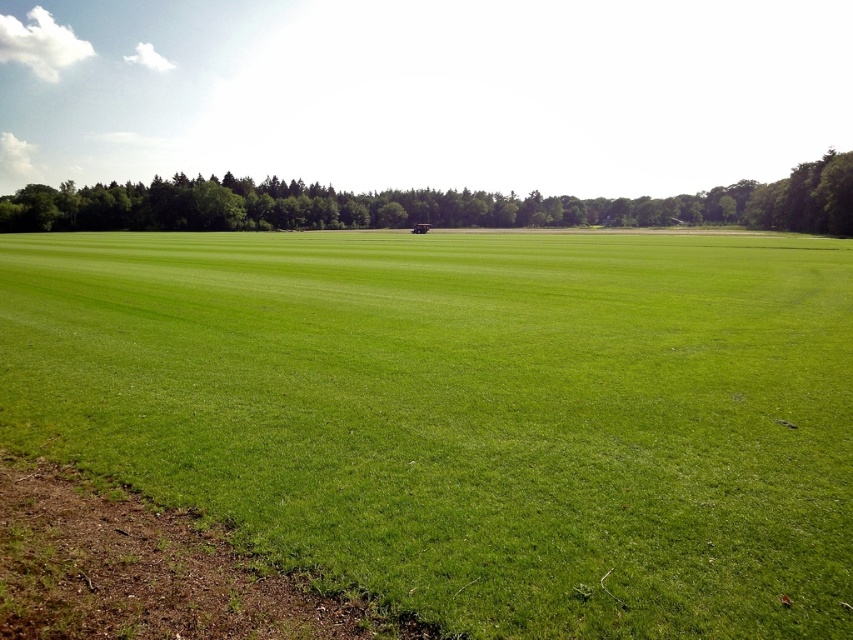
You are a drone operator trying to capture aerial footage of the green grass field at center and the green grassy field at center. Which one should you focus on first if you want to film the one closer to the camera?

The green grass field at center is in front of the green grassy field at center, so you should focus on the green grass field at center first as it is closer to the camera.

You are standing at the edge of the field looking towards the distant forest. You notice two points marked in the scene. Which of the two points, point [805,305] or point [790,212], is closer to your current position?

Point [805,305] is closer to the camera than point [790,212], so it is closer to your current position.

You are standing at the origin point of the coordinate system. You see a point labeled as point (468,413). What is located at that point?

At point (468,413) lies green grass field at center.